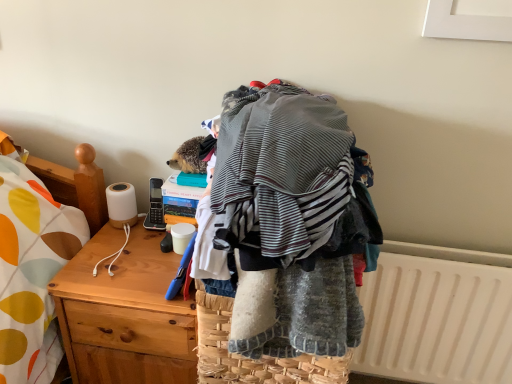
Measure the distance between point (382, 368) and camera.

Answer: The distance of point (382, 368) from camera is 1.45 meters.

Locate an element on the screen. Image resolution: width=512 pixels, height=384 pixels. white plastic radiator at lower right is located at coordinates (437, 315).

Where is `wooden desk at left`? The width and height of the screenshot is (512, 384). wooden desk at left is located at coordinates (125, 313).

Image resolution: width=512 pixels, height=384 pixels. In order to click on woven straw picnic basket at center in this screenshot , I will do `click(253, 359)`.

Does white plastic radiator at lower right have a greater width compared to wooden desk at left?

Incorrect, the width of white plastic radiator at lower right does not surpass that of wooden desk at left.

Can you confirm if white plastic radiator at lower right is smaller than wooden desk at left?

Correct, white plastic radiator at lower right occupies less space than wooden desk at left.

Considering the points (486, 371) and (138, 342), which point is behind, point (486, 371) or point (138, 342)?

The point (486, 371) is behind.

Can you confirm if white plastic radiator at lower right is taller than wooden desk at left?

No.

Can you tell me how much wooden desk at left and white plastic radiator at lower right differ in facing direction?

0.287 degrees.

Does wooden desk at left appear on the left side of white plastic radiator at lower right?

Yes.

Which is in front, point (106, 354) or point (468, 261)?

Point (106, 354)

The width and height of the screenshot is (512, 384). In order to click on desk below the white plastic radiator at lower right (from the image's perspective) in this screenshot , I will do `click(125, 313)`.

Considering the positions of point (70, 302) and point (195, 284), is point (70, 302) closer or farther from the camera than point (195, 284)?

Point (70, 302) appears to be farther away from the viewer than point (195, 284).

The image size is (512, 384). Identify the location of desk lying below the woven straw picnic basket at center (from the image's perspective). (125, 313).

From a real-world perspective, is wooden desk at left on top of woven straw picnic basket at center?

No, from a real-world perspective, wooden desk at left is not on top of woven straw picnic basket at center.

Is woven straw picnic basket at center outside of white plastic radiator at lower right?

Yes, woven straw picnic basket at center is located beyond the bounds of white plastic radiator at lower right.

Does woven straw picnic basket at center have a greater height compared to white plastic radiator at lower right?

No, woven straw picnic basket at center is not taller than white plastic radiator at lower right.

Is the position of woven straw picnic basket at center less distant than that of white plastic radiator at lower right?

Yes, it is.

From a real-world perspective, is woven straw picnic basket at center physically located above or below white plastic radiator at lower right?

From a real-world perspective, woven straw picnic basket at center is physically above white plastic radiator at lower right.

Which of these two, woven straw picnic basket at center or wooden desk at left, is thinner?

Thinner between the two is woven straw picnic basket at center.

Does woven straw picnic basket at center have a larger size compared to wooden desk at left?

No.

Is woven straw picnic basket at center turned away from wooden desk at left?

No, woven straw picnic basket at center is not facing the opposite direction of wooden desk at left.

Is there a large distance between woven straw picnic basket at center and wooden desk at left?

No, woven straw picnic basket at center is not far away from wooden desk at left.

In order to click on picnic basket in front of the white plastic radiator at lower right in this screenshot , I will do `click(253, 359)`.

Is white plastic radiator at lower right positioned behind woven straw picnic basket at center?

Yes, white plastic radiator at lower right is behind woven straw picnic basket at center.

From the image's perspective, is white plastic radiator at lower right positioned above or below woven straw picnic basket at center?

From the image's perspective, white plastic radiator at lower right appears below woven straw picnic basket at center.

Is the surface of white plastic radiator at lower right in direct contact with woven straw picnic basket at center?

No, white plastic radiator at lower right is not next to woven straw picnic basket at center.

You are a GUI agent. You are given a task and a screenshot of the screen. Output one action in this format:
    pyautogui.click(x=<x>, y=<y>)
    Task: Click on the radiator above the wooden desk at left (from the image's perspective)
    Image resolution: width=512 pixels, height=384 pixels.
    Given the screenshot: What is the action you would take?
    pyautogui.click(x=437, y=315)

Find the location of a particular element. Image resolution: width=512 pixels, height=384 pixels. desk in front of the white plastic radiator at lower right is located at coordinates (125, 313).

Considering their positions, is white plastic radiator at lower right positioned further to wooden desk at left than woven straw picnic basket at center?

white plastic radiator at lower right lies further to wooden desk at left than the other object.

Considering their positions, is wooden desk at left positioned further to white plastic radiator at lower right than woven straw picnic basket at center?

wooden desk at left is positioned further to the anchor white plastic radiator at lower right.

Which object lies nearer to the anchor point woven straw picnic basket at center, white plastic radiator at lower right or wooden desk at left?

wooden desk at left lies closer to woven straw picnic basket at center than the other object.

When comparing their distances from white plastic radiator at lower right, does woven straw picnic basket at center or wooden desk at left seem closer?

The object closer to white plastic radiator at lower right is woven straw picnic basket at center.

Based on their spatial positions, is wooden desk at left or white plastic radiator at lower right closer to woven straw picnic basket at center?

wooden desk at left is positioned closer to the anchor woven straw picnic basket at center.

Which object lies nearer to the anchor point wooden desk at left, woven straw picnic basket at center or white plastic radiator at lower right?

woven straw picnic basket at center.

Where is `picnic basket situated between wooden desk at left and white plastic radiator at lower right from left to right`? picnic basket situated between wooden desk at left and white plastic radiator at lower right from left to right is located at coordinates click(x=253, y=359).